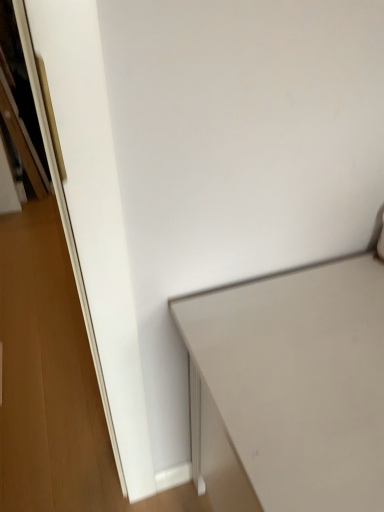
This screenshot has width=384, height=512. What do you see at coordinates (296, 381) in the screenshot?
I see `matte white table at lower right` at bounding box center [296, 381].

The height and width of the screenshot is (512, 384). Identify the location of matte white table at lower right. (296, 381).

Find the location of a particular element. The height and width of the screenshot is (512, 384). matte white table at lower right is located at coordinates (296, 381).